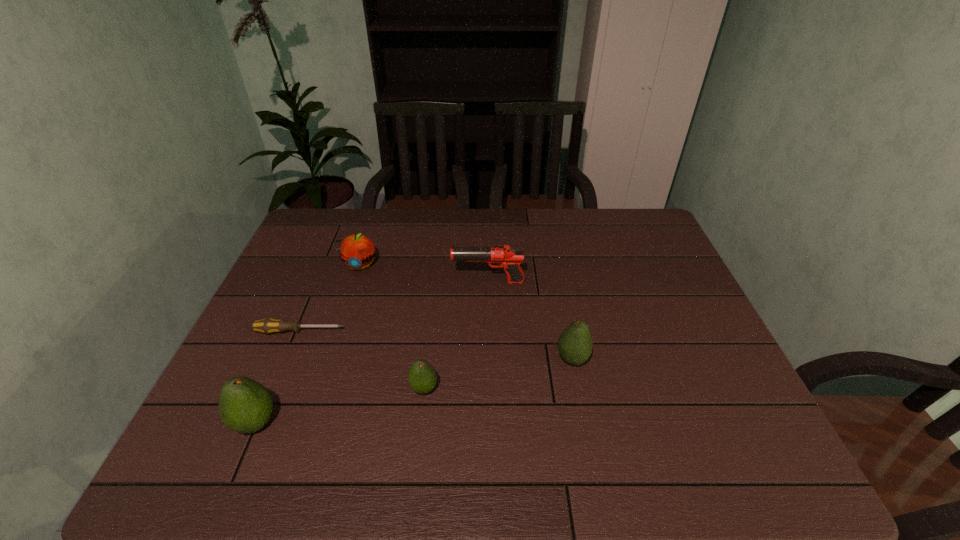
I want to click on the farthest object, so click(357, 251).

The height and width of the screenshot is (540, 960). Find the location of `vacant area located 0.120m on the right of the nearest avocado`. vacant area located 0.120m on the right of the nearest avocado is located at coordinates (333, 422).

Find the location of a particular element. The height and width of the screenshot is (540, 960). vacant space located on the left of the second avocado from right to left is located at coordinates (321, 389).

Where is `free location located on the back of the farthest avocado`? This screenshot has width=960, height=540. free location located on the back of the farthest avocado is located at coordinates (552, 255).

Locate an element on the screen. This screenshot has height=540, width=960. free location located at the aiming end of the gun is located at coordinates (328, 282).

I want to click on free space located 0.180m at the aiming end of the gun, so click(392, 282).

Where is `free space located at the aiming end of the gun`? free space located at the aiming end of the gun is located at coordinates (409, 282).

This screenshot has height=540, width=960. I want to click on vacant position located at the tip of the screwdriver, so click(x=431, y=332).

At what (x,y) coordinates should I click in order to perform the action: click on vacant point located 0.190m on the right of the farthest object. Please return your answer as a coordinate pair (x, y). The image size is (960, 540). Looking at the image, I should click on (439, 265).

Find the location of a particular element. The width and height of the screenshot is (960, 540). avocado that is at the left edge is located at coordinates (245, 406).